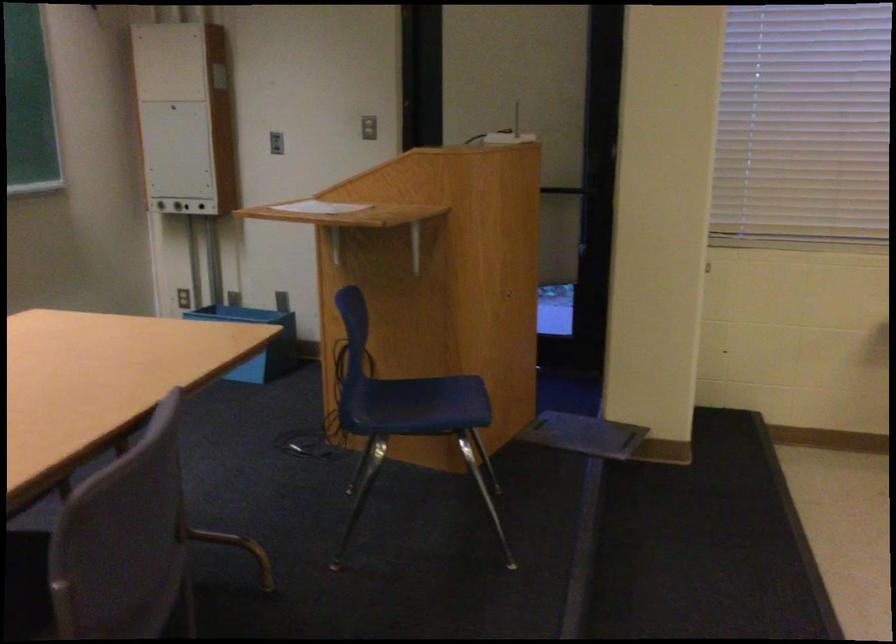
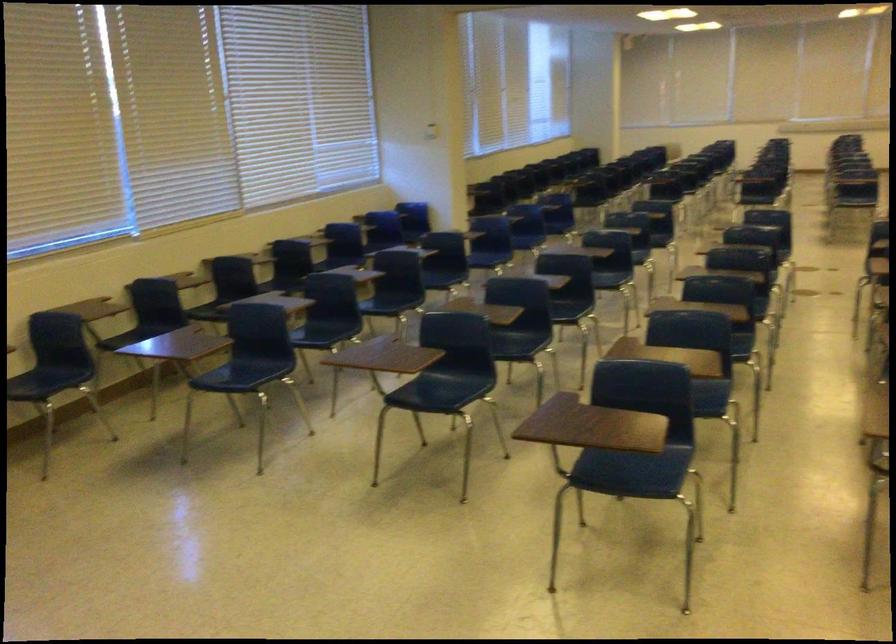
Question: How did the camera likely rotate?

Choices:
 (A) Left
 (B) Right
 (C) Up
 (D) Down

Answer: (B)